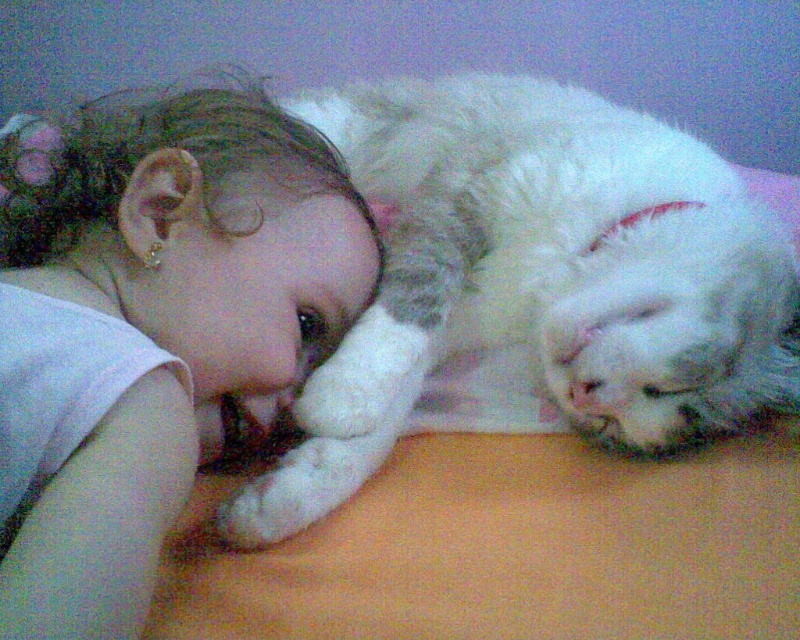
Question: Is smooth skin baby at center above white fluffy cat at upper right?

Choices:
 (A) yes
 (B) no

Answer: (B)

Question: Does smooth skin baby at center have a larger size compared to white fluffy cat at upper right?

Choices:
 (A) no
 (B) yes

Answer: (A)

Question: Can you confirm if smooth skin baby at center is positioned to the right of white fluffy cat at upper right?

Choices:
 (A) no
 (B) yes

Answer: (A)

Question: Which object is closer to the camera taking this photo?

Choices:
 (A) white fluffy cat at upper right
 (B) smooth skin baby at center

Answer: (B)

Question: Which of the following is the closest to the observer?

Choices:
 (A) (240, 424)
 (B) (476, 202)

Answer: (A)

Question: Among these objects, which one is farthest from the camera?

Choices:
 (A) smooth skin baby at center
 (B) white fluffy cat at upper right

Answer: (B)